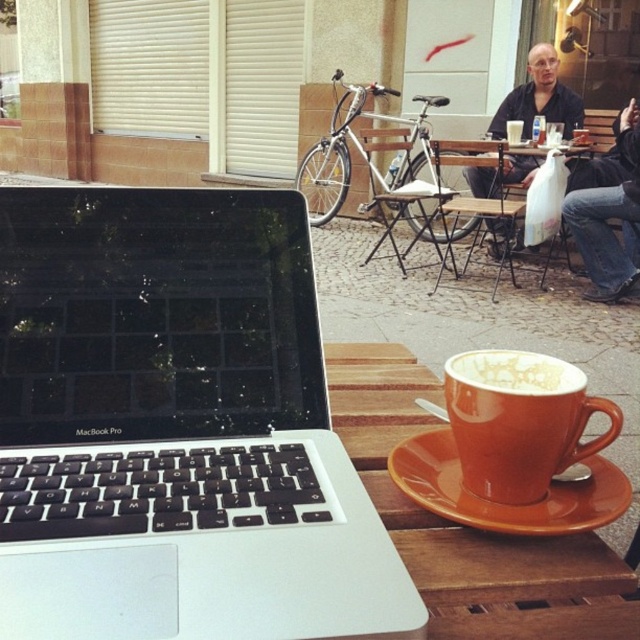
The width and height of the screenshot is (640, 640). I want to click on orange matte mug at lower center, so click(x=518, y=420).

Who is more forward, (545, 445) or (547, 68)?

Point (545, 445) is in front.

Where is `orange matte mug at lower center`? This screenshot has width=640, height=640. orange matte mug at lower center is located at coordinates (518, 420).

Is silver metallic laptop at center below orange ceramic saucer at lower center?

No, silver metallic laptop at center is not below orange ceramic saucer at lower center.

Between silver metallic laptop at center and orange ceramic saucer at lower center, which one appears on the right side from the viewer's perspective?

orange ceramic saucer at lower center

Describe the element at coordinates (176, 428) in the screenshot. The image size is (640, 640). I see `silver metallic laptop at center` at that location.

The height and width of the screenshot is (640, 640). What are the coordinates of `silver metallic laptop at center` in the screenshot? It's located at (176, 428).

What do you see at coordinates (176, 428) in the screenshot? Image resolution: width=640 pixels, height=640 pixels. I see `silver metallic laptop at center` at bounding box center [176, 428].

Which of these two, silver metallic laptop at center or orange matte cup at lower right, stands shorter?

orange matte cup at lower right is shorter.

Between point (10, 416) and point (474, 384), which one is positioned behind?

Point (10, 416)

This screenshot has height=640, width=640. Identify the location of silver metallic laptop at center. (176, 428).